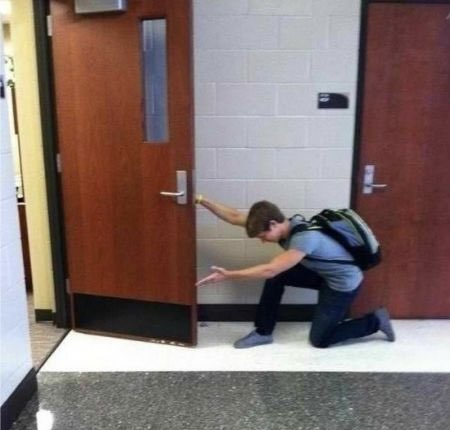
Where is `door handle`? The image size is (450, 430). door handle is located at coordinates (181, 193), (378, 185).